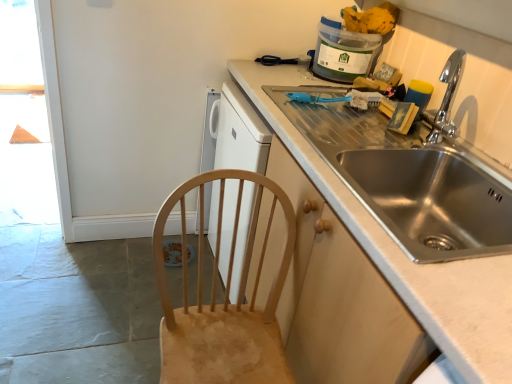
What is the approximate width of natural wood chair at lower left?

The width of natural wood chair at lower left is 19.02 inches.

The height and width of the screenshot is (384, 512). What do you see at coordinates (343, 52) in the screenshot?
I see `translucent plastic container at upper right` at bounding box center [343, 52].

Find the location of a particular element. The height and width of the screenshot is (384, 512). stainless steel sink at right is located at coordinates (405, 254).

From a real-world perspective, which object rests below the other?

From a 3D spatial view, natural wood chair at lower left is below.

Is natural wood chair at lower left oriented away from stainless steel sink at right?

No, stainless steel sink at right is not at the back of natural wood chair at lower left.

Considering the relative sizes of natural wood chair at lower left and stainless steel sink at right in the image provided, is natural wood chair at lower left thinner than stainless steel sink at right?

Yes.

Who is taller, natural wood chair at lower left or stainless steel sink at right?

stainless steel sink at right.

How different are the orientations of stainless steel sink at right and natural wood chair at lower left in degrees?

The angular difference between stainless steel sink at right and natural wood chair at lower left is 89 degrees.

Is stainless steel sink at right turned away from natural wood chair at lower left?

Yes, stainless steel sink at right is facing away from natural wood chair at lower left.

Looking at their sizes, would you say stainless steel sink at right is wider or thinner than natural wood chair at lower left?

In the image, stainless steel sink at right appears to be wider than natural wood chair at lower left.

From a real-world perspective, which object rests below the other?

In real-world perspective, natural wood chair at lower left is lower.

Measure the distance between translucent plastic container at upper right and stainless steel sink at right.

They are 23.51 inches apart.

Is there a large distance between translucent plastic container at upper right and stainless steel sink at right?

They are positioned close to each other.

In the image, is translucent plastic container at upper right positioned in front of or behind stainless steel sink at right?

Visually, translucent plastic container at upper right is located behind stainless steel sink at right.

Is translucent plastic container at upper right oriented towards stainless steel sink at right?

No, translucent plastic container at upper right is not facing towards stainless steel sink at right.

Between translucent plastic container at upper right and natural wood chair at lower left, which one has smaller width?

translucent plastic container at upper right is thinner.

Between translucent plastic container at upper right and natural wood chair at lower left, which one has less height?

translucent plastic container at upper right.

In the image, there is a natural wood chair at lower left. Identify the location of appliance above it (from the image's perspective). (343, 52).

Based on the photo, considering the sizes of translucent plastic container at upper right and natural wood chair at lower left in the image, is translucent plastic container at upper right bigger or smaller than natural wood chair at lower left?

In the image, translucent plastic container at upper right appears to be smaller than natural wood chair at lower left.

Is natural wood chair at lower left touching translucent plastic container at upper right?

No, natural wood chair at lower left is not in contact with translucent plastic container at upper right.

How distant is natural wood chair at lower left from translucent plastic container at upper right?

A distance of 34.83 inches exists between natural wood chair at lower left and translucent plastic container at upper right.

Which is behind, natural wood chair at lower left or translucent plastic container at upper right?

translucent plastic container at upper right is behind.

From a real-world perspective, is natural wood chair at lower left physically located above or below translucent plastic container at upper right?

Clearly, from a real-world perspective, natural wood chair at lower left is below translucent plastic container at upper right.

Considering the sizes of objects stainless steel sink at right and translucent plastic container at upper right in the image provided, who is shorter, stainless steel sink at right or translucent plastic container at upper right?

translucent plastic container at upper right is shorter.

Is stainless steel sink at right completely or partially outside of translucent plastic container at upper right?

Yes.

Is stainless steel sink at right wider than translucent plastic container at upper right?

Yes, stainless steel sink at right is wider than translucent plastic container at upper right.

Looking at this image, from the image's perspective, does stainless steel sink at right appear lower than translucent plastic container at upper right?

Correct, stainless steel sink at right appears lower than translucent plastic container at upper right in the image.

At what (x,y) coordinates should I click in order to perform the action: click on chair below the stainless steel sink at right (from a real-world perspective). Please return your answer as a coordinate pair (x, y). Looking at the image, I should click on (224, 299).

Locate an element on the screen. This screenshot has width=512, height=384. chair that appears in front of the stainless steel sink at right is located at coordinates (224, 299).

Based on the photo, based on their spatial positions, is stainless steel sink at right or natural wood chair at lower left further from translucent plastic container at upper right?

natural wood chair at lower left is positioned further to the anchor translucent plastic container at upper right.

When comparing their distances from natural wood chair at lower left, does stainless steel sink at right or translucent plastic container at upper right seem closer?

stainless steel sink at right lies closer to natural wood chair at lower left than the other object.

Estimate the real-world distances between objects in this image. Which object is closer to stainless steel sink at right, natural wood chair at lower left or translucent plastic container at upper right?

Among the two, natural wood chair at lower left is located nearer to stainless steel sink at right.

Looking at this image, which object lies nearer to the anchor point translucent plastic container at upper right, natural wood chair at lower left or stainless steel sink at right?

Based on the image, stainless steel sink at right appears to be nearer to translucent plastic container at upper right.

When comparing their distances from stainless steel sink at right, does translucent plastic container at upper right or natural wood chair at lower left seem further?

Based on the image, translucent plastic container at upper right appears to be further to stainless steel sink at right.

From the picture: Estimate the real-world distances between objects in this image. Which object is closer to natural wood chair at lower left, translucent plastic container at upper right or stainless steel sink at right?

stainless steel sink at right is positioned closer to the anchor natural wood chair at lower left.

Where is `countertop between translucent plastic container at upper right and natural wood chair at lower left in the up-down direction`? countertop between translucent plastic container at upper right and natural wood chair at lower left in the up-down direction is located at coordinates (405, 254).